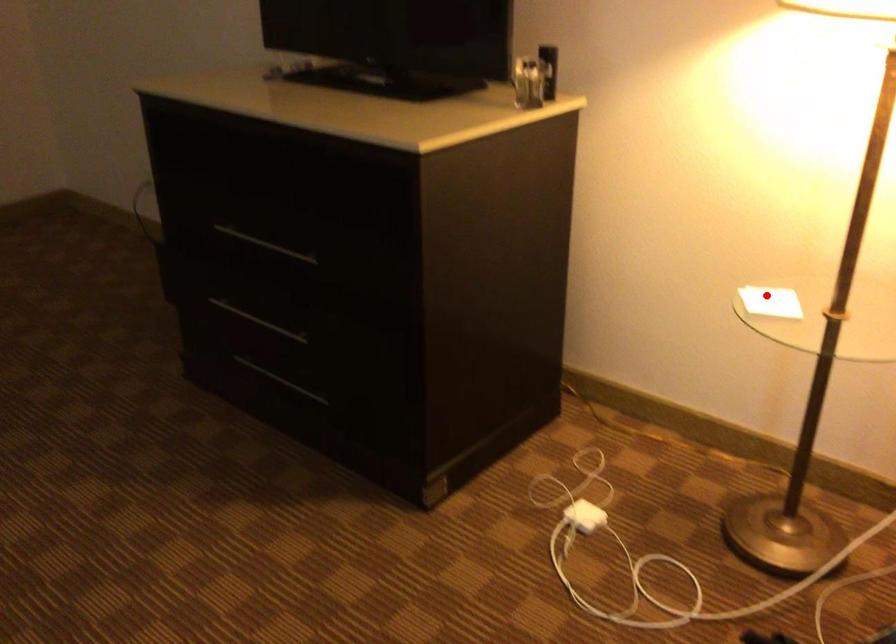
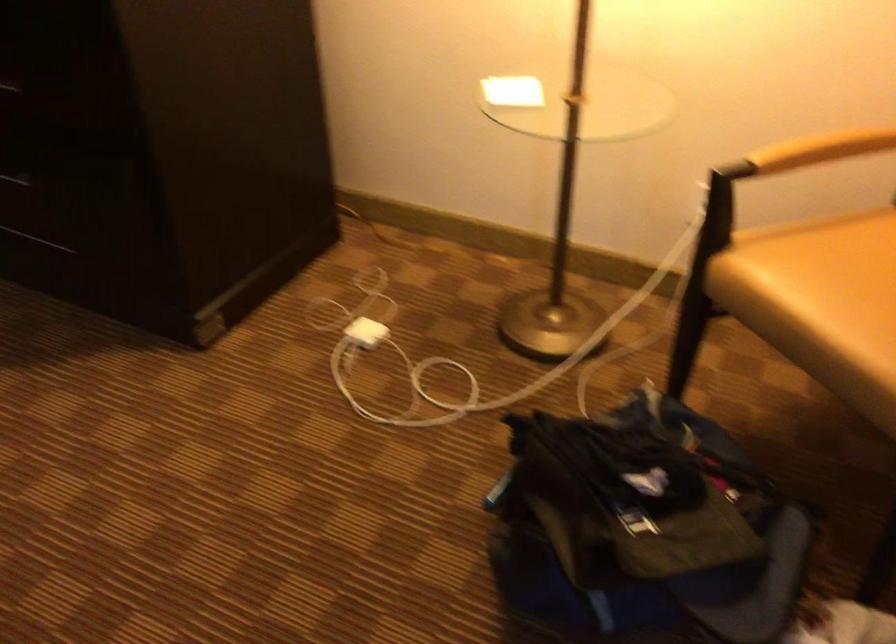
In the second image, find the point that corresponds to the highlighted location in the first image.

(513, 91)